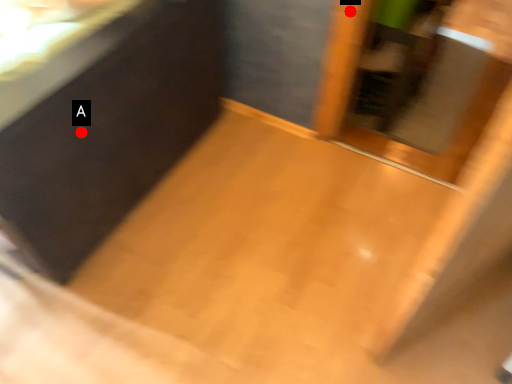
Question: Two points are circled on the image, labeled by A and B beside each circle. Which point appears farthest from the camera in this image?

Choices:
 (A) A is further
 (B) B is further

Answer: (B)